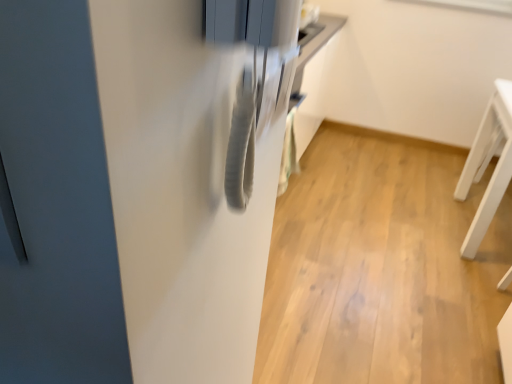
Measure the distance between point [510,150] and camera.

They are 6.43 feet apart.

Locate an element on the screen. This screenshot has height=384, width=512. white matte table at right is located at coordinates (487, 164).

Describe the element at coordinates (487, 164) in the screenshot. I see `white matte table at right` at that location.

You are a GUI agent. You are given a task and a screenshot of the screen. Output one action in this format:
    pyautogui.click(x=<x>, y=<y>)
    Task: Click on the white matte table at right
    Image resolution: width=512 pixels, height=384 pixels.
    Given the screenshot: What is the action you would take?
    pyautogui.click(x=487, y=164)